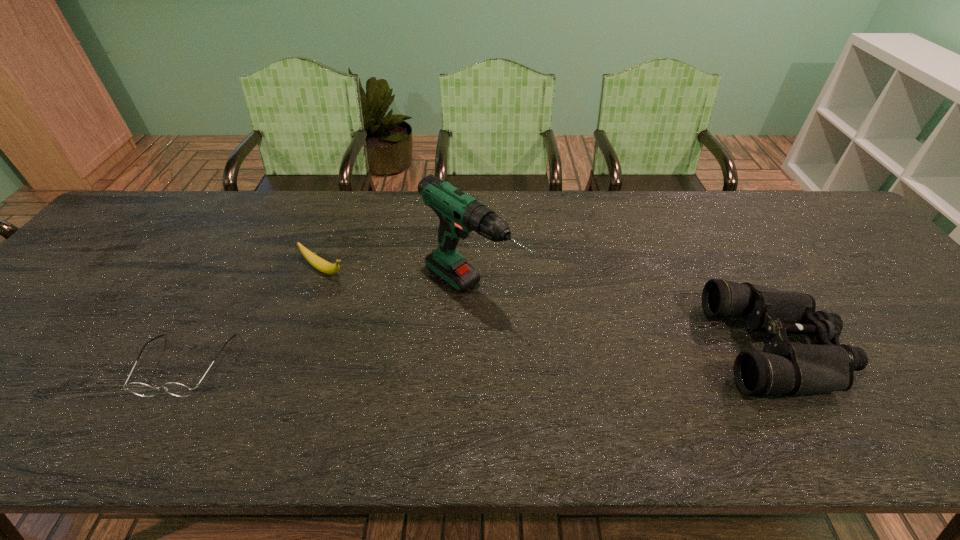
Identify the location of vacant area between the binoculars and the spectacles. This screenshot has height=540, width=960. (481, 356).

Where is `object that is the closest to the banana`? This screenshot has width=960, height=540. object that is the closest to the banana is located at coordinates (141, 389).

The image size is (960, 540). Identify the location of object that is the second closest to the rightmost object. pos(317,262).

At what (x,y) coordinates should I click in order to perform the action: click on blank space that satisfies the following two spatial constraints: 1. on the front side of the binoculars; 2. through the eyepieces of the third object from left to right. Please return your answer as a coordinate pair (x, y). Looking at the image, I should click on (471, 347).

The image size is (960, 540). I want to click on free location that satisfies the following two spatial constraints: 1. on the front side of the binoculars; 2. through the eyepieces of the tallest object, so click(471, 347).